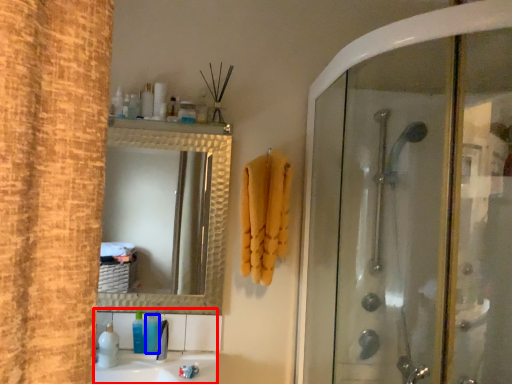
Question: Which object is closer to the camera taking this photo, sink (highlighted by a red box) or toiletry (highlighted by a blue box)?

Choices:
 (A) sink
 (B) toiletry

Answer: (A)